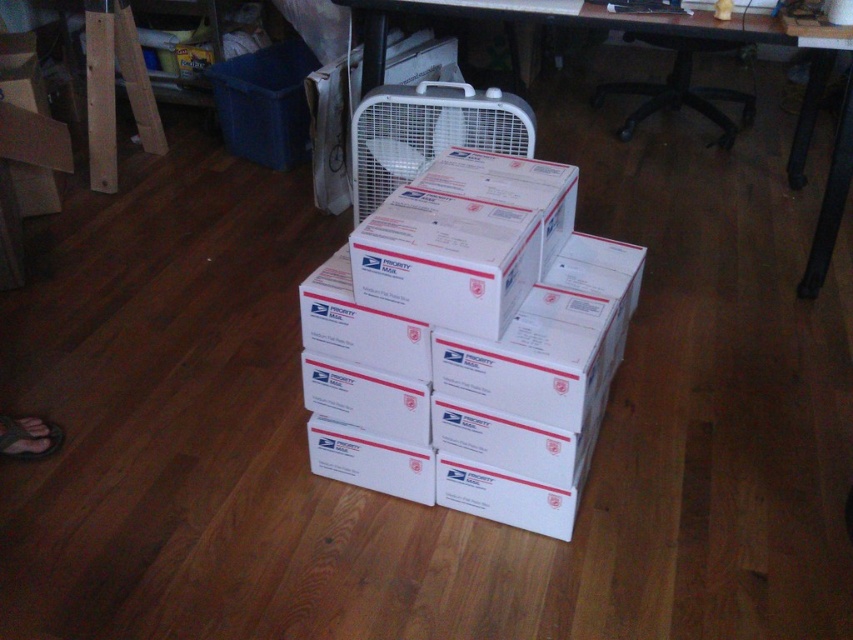
You are organizing items in a room and need to place a new computer desk. You see the white cardboard boxes at center and the white plastic computer desk at upper center. Where should you place the new desk so it doesn not block the boxes?

The white cardboard boxes at center are already positioned below the white plastic computer desk at upper center. To avoid blocking them, place the new desk in an area not directly above the boxes, ensuring clearance between the desk and the boxes.

From the picture: You are moving into a new apartment and need to place your white cardboard boxes at center and white plastic computer desk at upper center in the room. The doorway is 32 inches wide. Can you safely move both items through the doorway one at a time?

The distance between the white cardboard boxes at center and white plastic computer desk at upper center is 36.61 inches. Since the doorway is only 32 inches wide, neither item can fit through the doorway as they are both wider than the doorway.